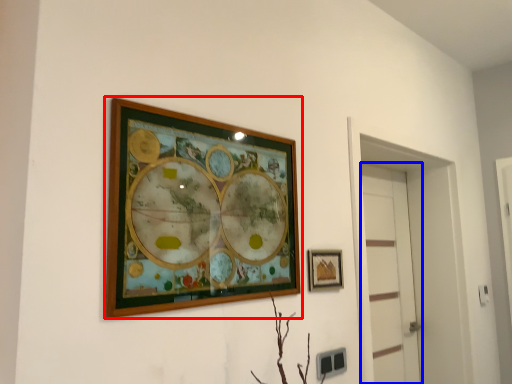
Question: Which of the following is the closest to the observer, picture frame (highlighted by a red box) or door (highlighted by a blue box)?

Choices:
 (A) picture frame
 (B) door

Answer: (A)